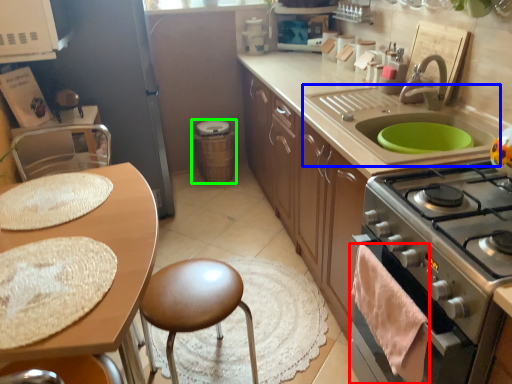
Question: Which object is the closest to the material (highlighted by a red box)? Choose among these: sink (highlighted by a blue box) or appliance (highlighted by a green box).

Choices:
 (A) sink
 (B) appliance

Answer: (A)